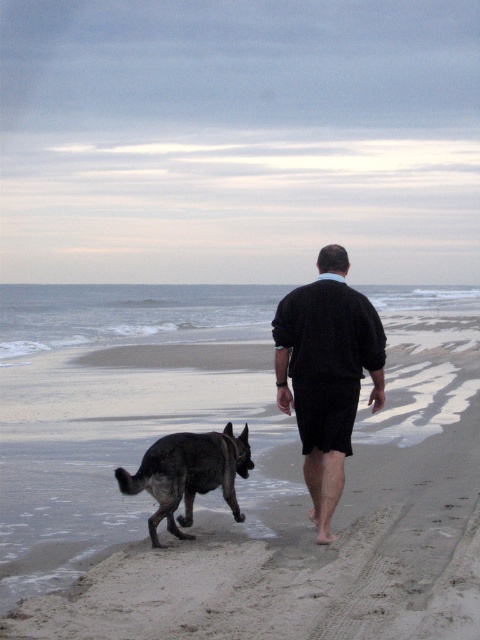
Question: Based on their relative distances, which object is nearer to the sandy beach at center?

Choices:
 (A) dark brown fur dog at lower left
 (B) dark blue sweater at center

Answer: (B)

Question: Which point is farther from the camera taking this photo?

Choices:
 (A) (323, 513)
 (B) (242, 515)
 (C) (72, 588)

Answer: (B)

Question: Does dark blue sweater at center lie behind dark brown fur dog at lower left?

Choices:
 (A) no
 (B) yes

Answer: (B)

Question: Is the position of sandy beach at center less distant than that of dark blue sweater at center?

Choices:
 (A) no
 (B) yes

Answer: (B)

Question: Does dark blue sweater at center appear over dark brown fur dog at lower left?

Choices:
 (A) yes
 (B) no

Answer: (A)

Question: Which point is closer to the camera?

Choices:
 (A) dark brown fur dog at lower left
 (B) dark blue sweater at center
 (C) sandy beach at center

Answer: (C)